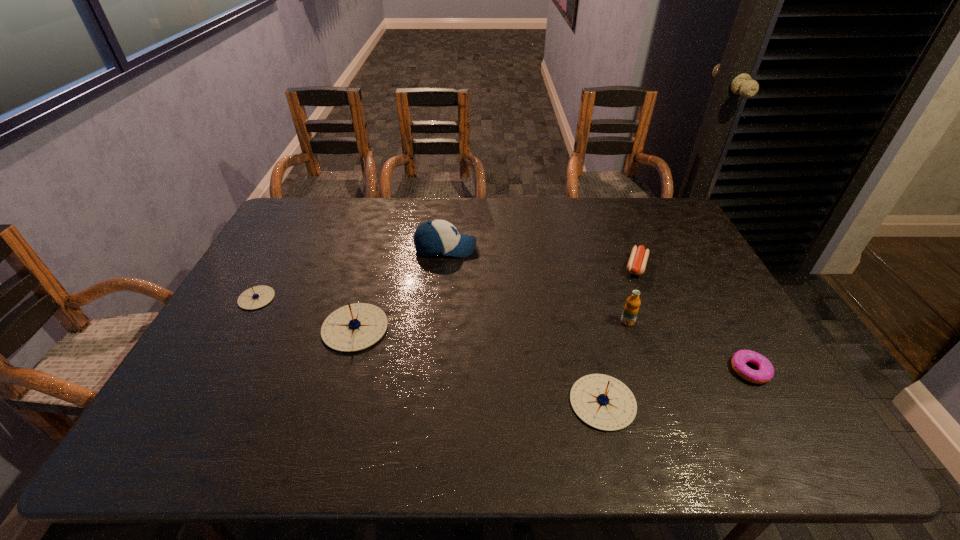
Locate an element on the screen. The image size is (960, 540). object situated at the left edge is located at coordinates (256, 297).

The width and height of the screenshot is (960, 540). What are the coordinates of `object that is positioned at the right edge` in the screenshot? It's located at (765, 373).

Image resolution: width=960 pixels, height=540 pixels. I want to click on object at the near right corner, so click(765, 373).

Where is `vacant space at the far edge of the desktop`? vacant space at the far edge of the desktop is located at coordinates (359, 216).

You are a GUI agent. You are given a task and a screenshot of the screen. Output one action in this format:
    pyautogui.click(x=<x>, y=<y>)
    Task: Click on the vacant area at the near edge
    
    Given the screenshot: What is the action you would take?
    pyautogui.click(x=659, y=407)

In the image, there is a desktop. Identify the location of vacant space at the right edge. (682, 260).

Where is `vacant space at the near left corner of the desktop`? Image resolution: width=960 pixels, height=540 pixels. vacant space at the near left corner of the desktop is located at coordinates (203, 377).

Where is `vacant space at the far right corner of the desktop`? This screenshot has height=540, width=960. vacant space at the far right corner of the desktop is located at coordinates (x=666, y=234).

Find the location of a particular element. The image size is (960, 540). vacant area between the shortest compass and the orange juice is located at coordinates (442, 310).

The image size is (960, 540). In order to click on vacant point located between the rightmost compass and the orange juice in this screenshot , I will do `click(615, 362)`.